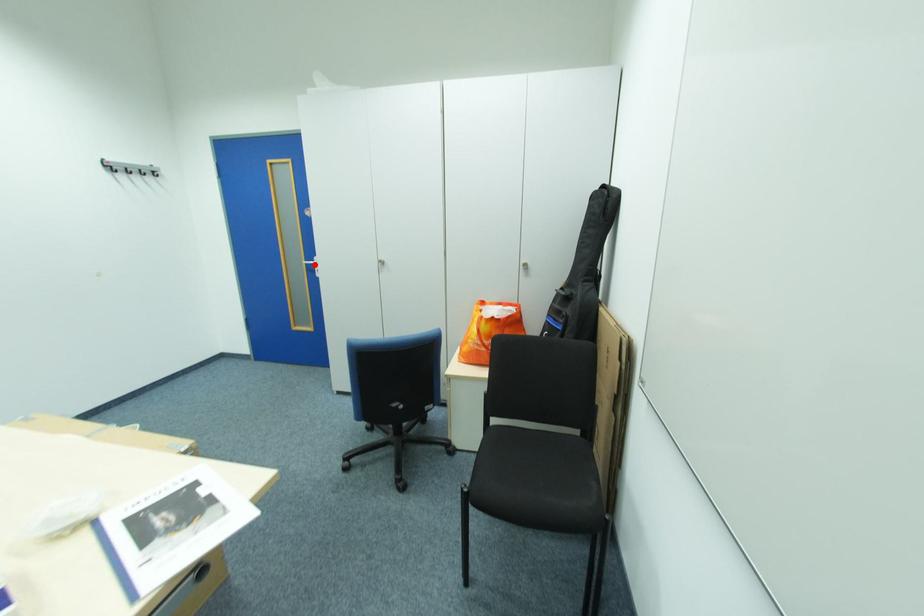
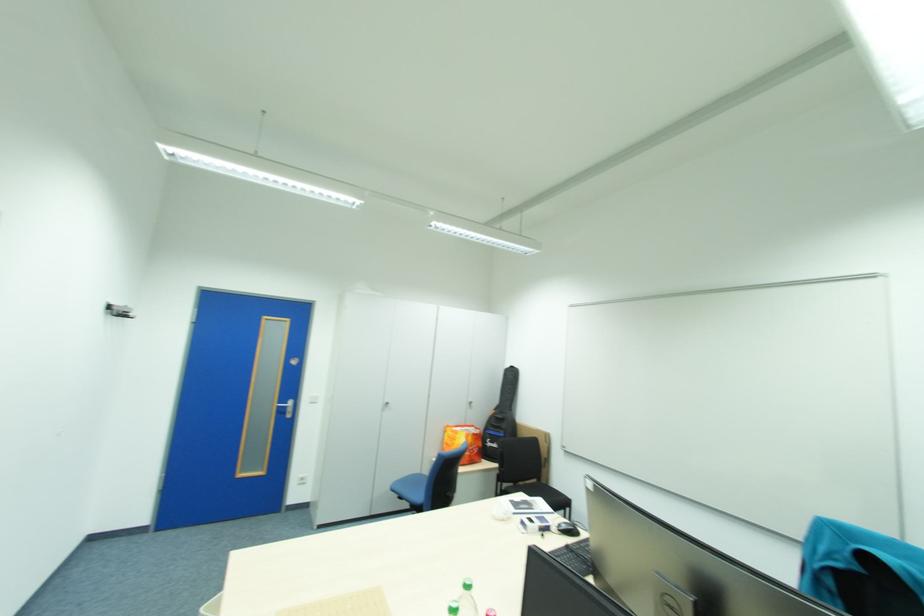
Question: I am providing you with two images of the same scene from different viewpoints. A red point is marked on the first image. Can you still see the location of the red point in image 2?

Choices:
 (A) Yes
 (B) No

Answer: (A)